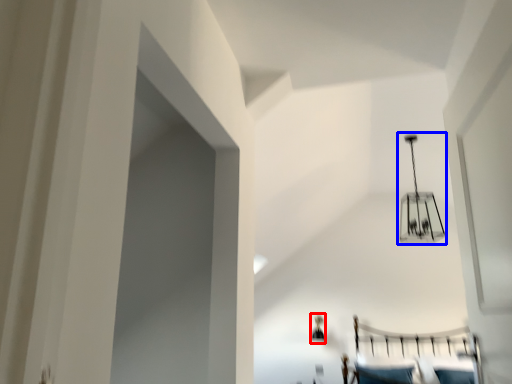
Question: Among these objects, which one is nearest to the camera, lamp (highlighted by a red box) or lamp (highlighted by a blue box)?

Choices:
 (A) lamp
 (B) lamp

Answer: (B)